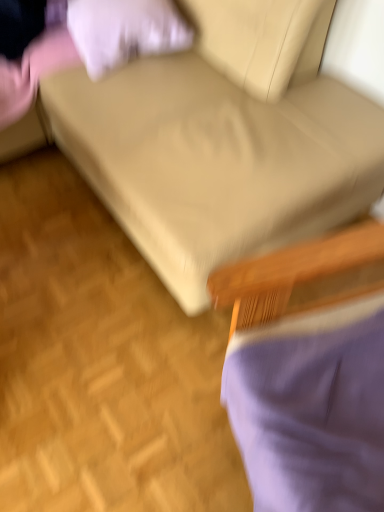
Identify the location of purple fabric chair at lower right. Image resolution: width=384 pixels, height=512 pixels. (307, 374).

Measure the distance from white soft pillow at upper left to purple fabric chair at lower right.

The distance of white soft pillow at upper left from purple fabric chair at lower right is 37.16 inches.

Does white soft pillow at upper left have a greater width compared to purple fabric chair at lower right?

No.

Considering the positions of objects white soft pillow at upper left and purple fabric chair at lower right in the image provided, who is more to the right, white soft pillow at upper left or purple fabric chair at lower right?

From the viewer's perspective, purple fabric chair at lower right appears more on the right side.

Are white soft pillow at upper left and purple fabric chair at lower right far apart?

No, white soft pillow at upper left is not far away from purple fabric chair at lower right.

Is purple fabric chair at lower right behind white soft pillow at upper left?

No, purple fabric chair at lower right is closer to the camera.

Is purple fabric chair at lower right looking in the opposite direction of white soft pillow at upper left?

No, purple fabric chair at lower right's orientation is not away from white soft pillow at upper left.

Can you confirm if purple fabric chair at lower right is wider than white soft pillow at upper left?

Correct, the width of purple fabric chair at lower right exceeds that of white soft pillow at upper left.

Is there a large distance between purple fabric chair at lower right and white soft pillow at upper left?

purple fabric chair at lower right is actually quite close to white soft pillow at upper left.

Does point (178, 186) appear closer or farther from the camera than point (77, 40)?

Point (178, 186) is positioned closer to the camera compared to point (77, 40).

From a real-world perspective, is beige fabric couch at center physically located above or below white soft pillow at upper left?

In terms of real-world spatial position, beige fabric couch at center is above white soft pillow at upper left.

Based on their positions, is beige fabric couch at center located to the left or right of white soft pillow at upper left?

Based on their positions, beige fabric couch at center is located to the right of white soft pillow at upper left.

Is beige fabric couch at center not near white soft pillow at upper left?

beige fabric couch at center is near white soft pillow at upper left, not far away.

From the image's perspective, which one is positioned lower, purple fabric chair at lower right or beige fabric couch at center?

purple fabric chair at lower right is shown below in the image.

Is point (305, 309) in front of point (239, 117)?

That is True.

Who is more distant, purple fabric chair at lower right or beige fabric couch at center?

beige fabric couch at center is further away from the camera.

From the image's perspective, is white soft pillow at upper left above or below beige fabric couch at center?

From the image's perspective, white soft pillow at upper left appears below beige fabric couch at center.

Which is behind, point (150, 33) or point (102, 120)?

The point (150, 33) is farther from the camera.

Looking at their sizes, would you say white soft pillow at upper left is wider or thinner than beige fabric couch at center?

Clearly, white soft pillow at upper left has less width compared to beige fabric couch at center.

Is white soft pillow at upper left taller or shorter than beige fabric couch at center?

white soft pillow at upper left is shorter than beige fabric couch at center.

Is beige fabric couch at center oriented towards purple fabric chair at lower right?

Yes, beige fabric couch at center is oriented towards purple fabric chair at lower right.

From the picture: Does beige fabric couch at center have a greater height compared to purple fabric chair at lower right?

Result: Correct, beige fabric couch at center is much taller as purple fabric chair at lower right.

What are the coordinates of `studio couch on the left of purple fabric chair at lower right` in the screenshot? It's located at (215, 161).

Where is `pillow above the purple fabric chair at lower right (from a real-world perspective)`? This screenshot has height=512, width=384. pillow above the purple fabric chair at lower right (from a real-world perspective) is located at coordinates (124, 31).

Locate an element on the screen. This screenshot has height=512, width=384. chair that appears below the white soft pillow at upper left (from the image's perspective) is located at coordinates (307, 374).

When comparing their distances from white soft pillow at upper left, does purple fabric chair at lower right or beige fabric couch at center seem closer?

beige fabric couch at center is closer to white soft pillow at upper left.

From the image, which object appears to be farther from beige fabric couch at center, purple fabric chair at lower right or white soft pillow at upper left?

purple fabric chair at lower right.

Looking at the image, which one is located further to purple fabric chair at lower right, beige fabric couch at center or white soft pillow at upper left?

The object further to purple fabric chair at lower right is white soft pillow at upper left.

When comparing their distances from white soft pillow at upper left, does beige fabric couch at center or purple fabric chair at lower right seem further?

purple fabric chair at lower right is positioned further to the anchor white soft pillow at upper left.

Estimate the real-world distances between objects in this image. Which object is closer to purple fabric chair at lower right, white soft pillow at upper left or beige fabric couch at center?

Among the two, beige fabric couch at center is located nearer to purple fabric chair at lower right.

Which object lies further to the anchor point beige fabric couch at center, white soft pillow at upper left or purple fabric chair at lower right?

Among the two, purple fabric chair at lower right is located further to beige fabric couch at center.

You are a GUI agent. You are given a task and a screenshot of the screen. Output one action in this format:
    pyautogui.click(x=<x>, y=<y>)
    Task: Click on the pillow between beige fabric couch at center and purple fabric chair at lower right from top to bottom
    
    Given the screenshot: What is the action you would take?
    pyautogui.click(x=124, y=31)